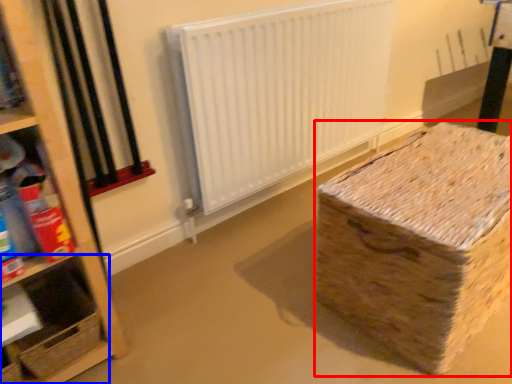
Question: Among these objects, which one is farthest to the camera, cardboard box (highlighted by a red box) or shelf (highlighted by a blue box)?

Choices:
 (A) cardboard box
 (B) shelf

Answer: (B)